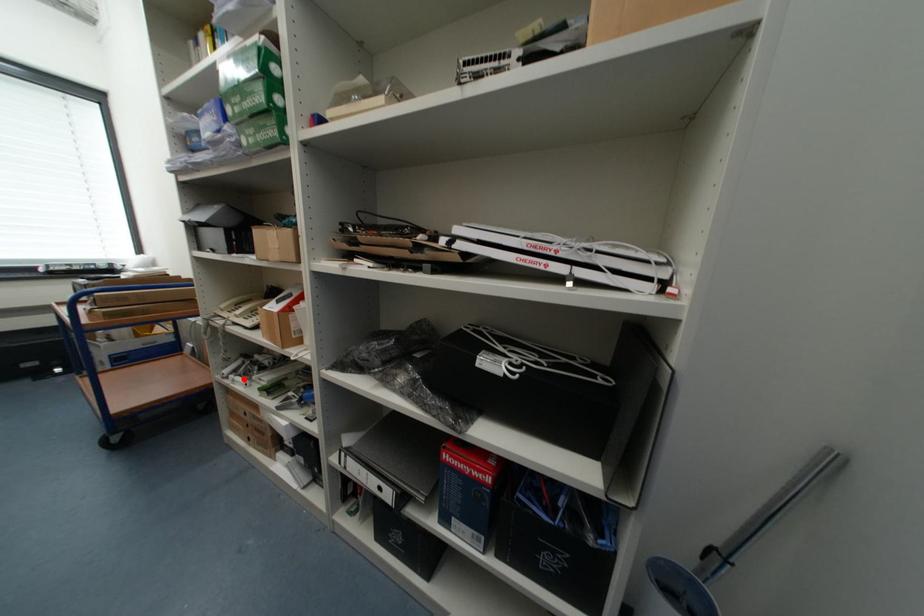
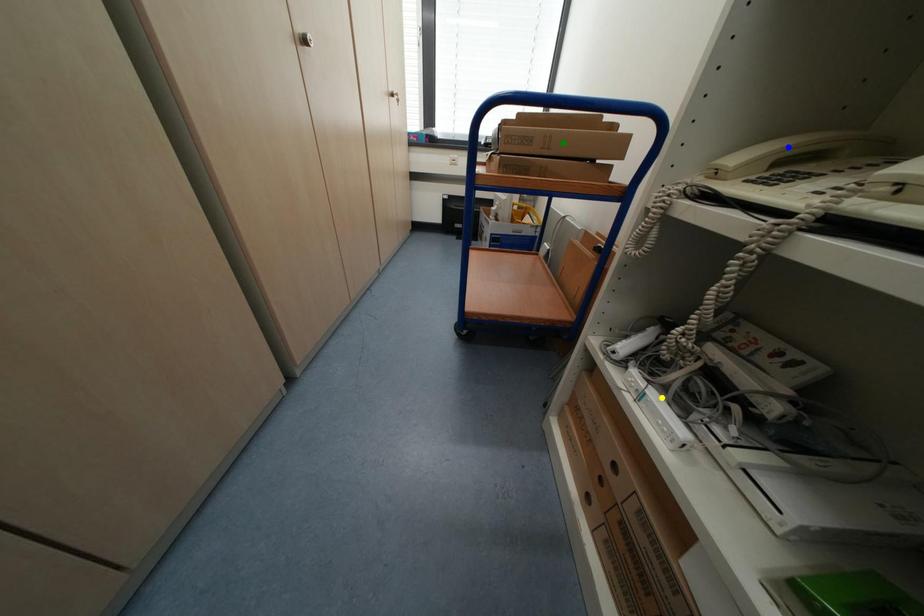
Question: I am providing you with two images of the same scene from different viewpoints. A red point is marked on the first image. You are given multiple points on the second image. Which point in image 2 represents the same 3d spot as the red point in image 1?

Choices:
 (A) yellow point
 (B) blue point
 (C) green point

Answer: (A)